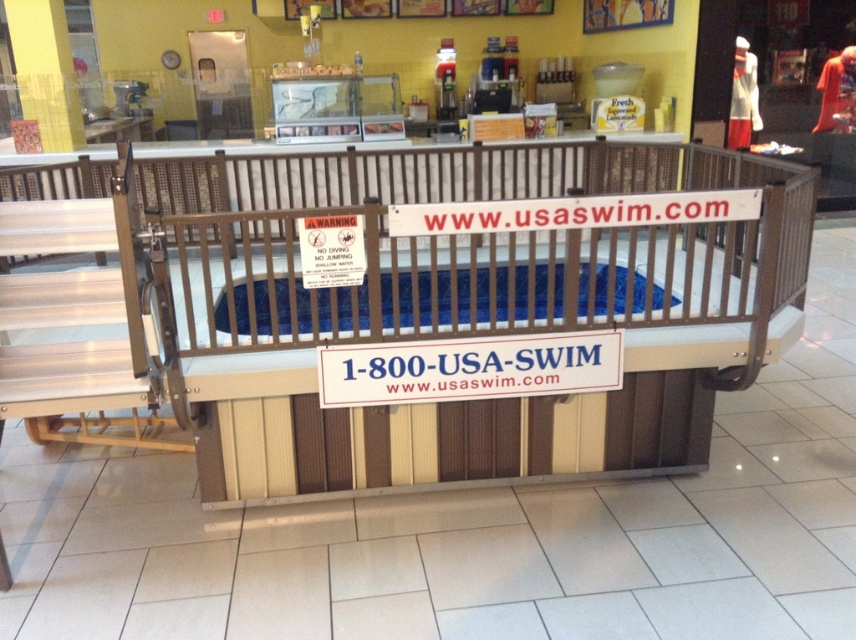
Question: Does white plastic sign at center have a larger size compared to blue plastic infant bed at center?

Choices:
 (A) no
 (B) yes

Answer: (A)

Question: Among these points, which one is nearest to the camera?

Choices:
 (A) 283,305
 (B) 209,284

Answer: (B)

Question: Estimate the real-world distances between objects in this image. Which object is farther from the blue plastic infant bed at center?

Choices:
 (A) white plastic sign at center
 (B) blue fabric infant bed at center

Answer: (A)

Question: Among these points, which one is nearest to the camera?

Choices:
 (A) (486, 216)
 (B) (325, 403)

Answer: (A)

Question: Does white plastic sign at center have a smaller size compared to blue plastic infant bed at center?

Choices:
 (A) yes
 (B) no

Answer: (A)

Question: Is white plastic sign at center to the left of blue plastic infant bed at center from the viewer's perspective?

Choices:
 (A) no
 (B) yes

Answer: (A)